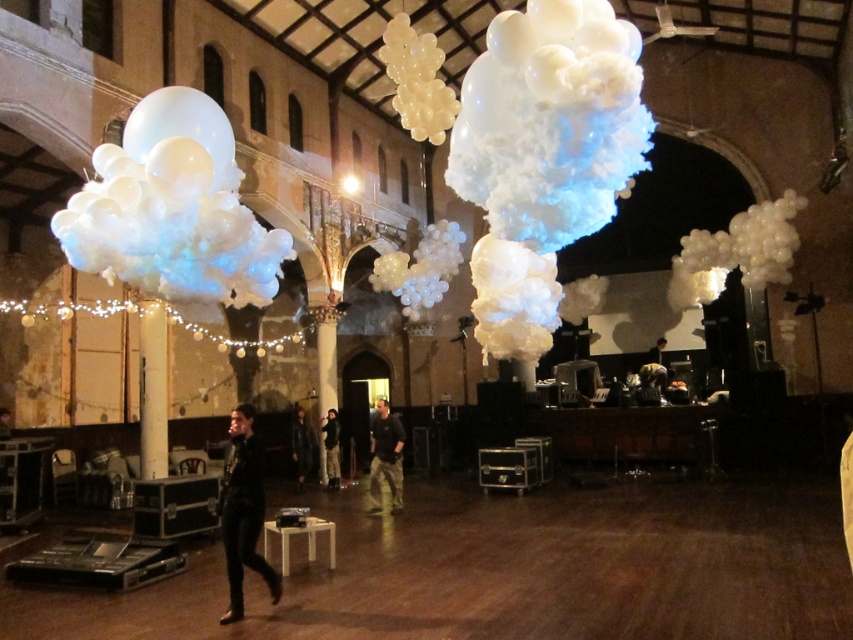
Question: Does matte white cloud at left have a larger size compared to black matte clothing at center?

Choices:
 (A) yes
 (B) no

Answer: (A)

Question: Which point is farther from the camera taking this photo?

Choices:
 (A) (337, 477)
 (B) (289, 429)

Answer: (B)

Question: Which object is closer to the camera taking this photo?

Choices:
 (A) dark brown leather jacket at center
 (B) matte white cloud at left
 (C) dark gray jacket at center
 (D) leather jacket at center

Answer: (B)

Question: Is matte white cloud at left above dark brown leather jacket at center?

Choices:
 (A) no
 (B) yes

Answer: (B)

Question: Is black matte clothing at center below dark brown leather jacket at center?

Choices:
 (A) no
 (B) yes

Answer: (B)

Question: Based on their relative distances, which object is nearer to the dark gray jacket at center?

Choices:
 (A) leather jacket at center
 (B) black matte clothing at center
 (C) dark brown leather jacket at center

Answer: (A)